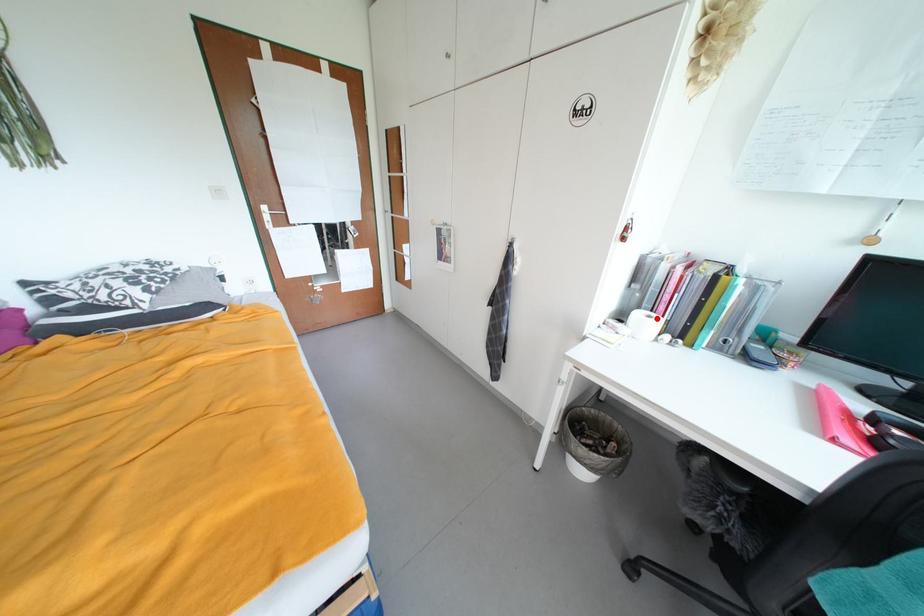
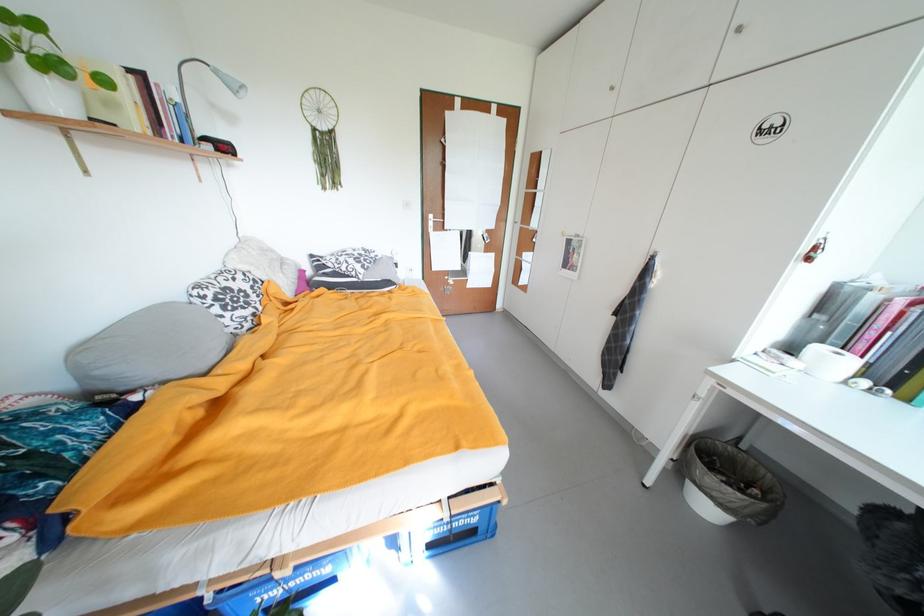
Find the pixel in the second image that matches the highlighted location in the first image.

(845, 355)